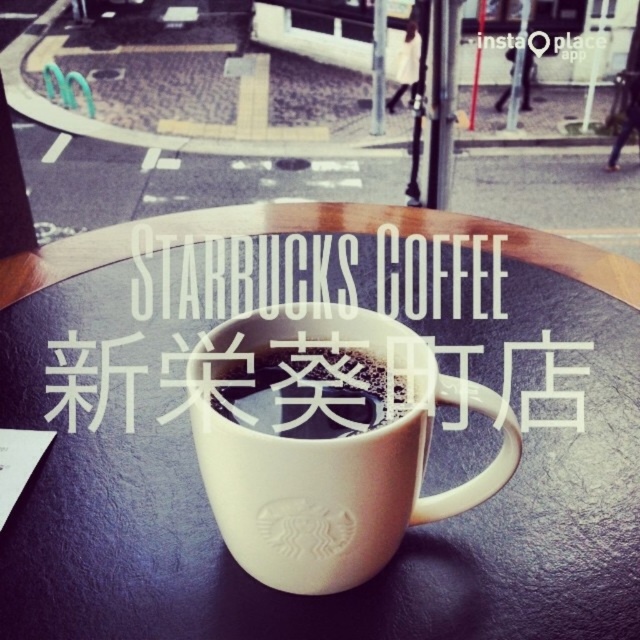
Can you confirm if white ceramic mug at center is smaller than white matte text at center?

Correct, white ceramic mug at center occupies less space than white matte text at center.

Between white ceramic mug at center and white matte text at center, which one appears on the left side from the viewer's perspective?

Positioned to the left is white matte text at center.

You are a GUI agent. You are given a task and a screenshot of the screen. Output one action in this format:
    pyautogui.click(x=<x>, y=<y>)
    Task: Click on the white ceramic mug at center
    The width and height of the screenshot is (640, 640).
    Given the screenshot: What is the action you would take?
    pyautogui.click(x=324, y=440)

Is white matte table at center smaller than white ceramic mug at center?

Actually, white matte table at center might be larger than white ceramic mug at center.

This screenshot has width=640, height=640. What do you see at coordinates (333, 337) in the screenshot?
I see `white matte table at center` at bounding box center [333, 337].

Is point (192, 580) farther from camera compared to point (321, 368)?

No, (192, 580) is in front of (321, 368).

At what (x,y) coordinates should I click in order to perform the action: click on white matte table at center. Please return your answer as a coordinate pair (x, y). Looking at the image, I should click on (333, 337).

Does white matte table at center have a greater height compared to white matte text at center?

Yes, white matte table at center is taller than white matte text at center.

Who is shorter, white matte table at center or white matte text at center?

white matte text at center is shorter.

Does point (476, 532) come in front of point (157, 307)?

That is True.

Locate an element on the screen. white matte table at center is located at coordinates (333, 337).